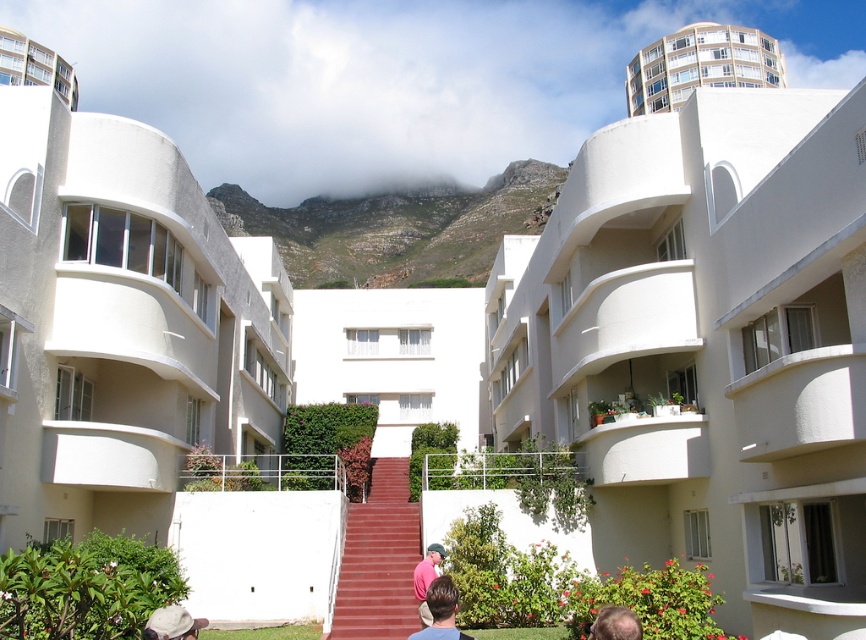
You are standing at the base of the red staircase in the center. Which direction should you look to see the white glossy balcony at upper left?

You should look to the upper left direction to see the white glossy balcony at upper left, as it is located at point coordinates of (34, 65).

You are standing at the base of the red staircase in the center of the modern architectural scene. You want to reach the white glossy balcony at upper left marked by point (x=34, y=65). Which direction should you move relative to your current position?

The white glossy balcony at upper left marked by point (x=34, y=65) is located to the upper left of your current position at the base of the red staircase in the center. You should move towards the upper left direction to reach it.